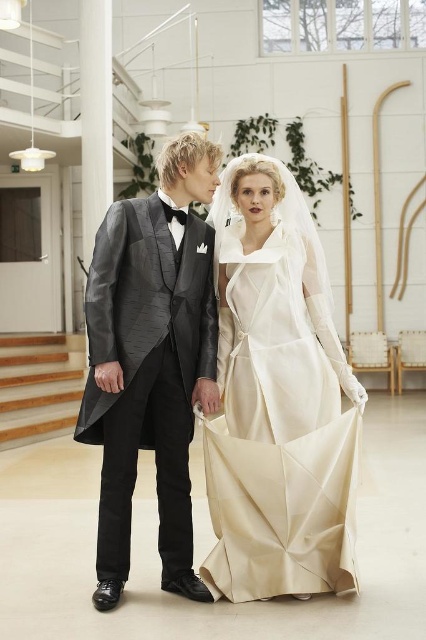
Image resolution: width=426 pixels, height=640 pixels. What are the coordinates of `ivory satin dress at center` in the screenshot? It's located at (278, 400).

Can you confirm if ivory satin dress at center is positioned to the left of shiny black tuxedo at center?

No, ivory satin dress at center is not to the left of shiny black tuxedo at center.

Measure the distance between ivory satin dress at center and camera.

ivory satin dress at center and camera are 2.92 meters apart.

I want to click on ivory satin dress at center, so click(278, 400).